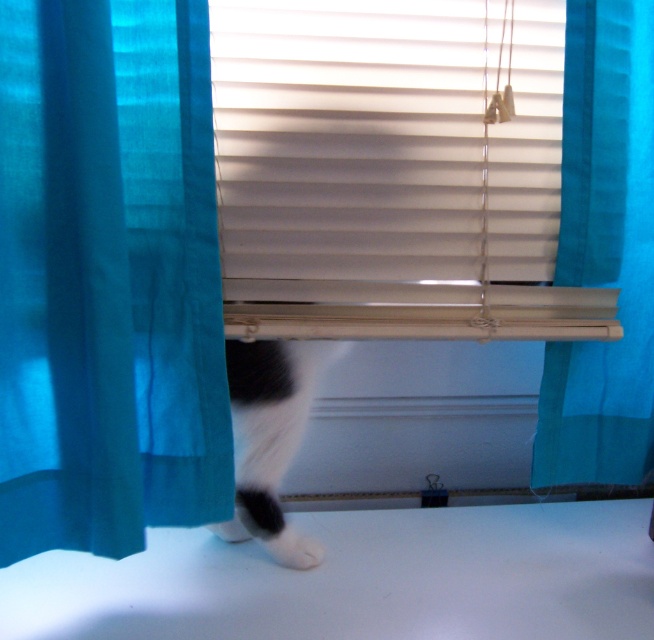
You are standing in the room and want to see the cat behind the teal sheer curtain at left. Where should you look to find the cat?

The cat is behind the teal sheer curtain at left, which is located at point (107, 276).

You are a small toy mouse. You want to roll from the teal sheer curtain at left to the black and white fur at lower center. Can you make it in one roll without stopping?

The teal sheer curtain at left and black and white fur at lower center are 18.37 centimeters apart, so yes, the toy mouse can roll from the teal sheer curtain at left to the black and white fur at lower center in one roll without stopping as the distance is manageable.

You are looking at the window with the white plastic blinds at center and the black and white fur at lower center. Which object is positioned to the right of the other?

The white plastic blinds at center are to the right of the black and white fur at lower center.